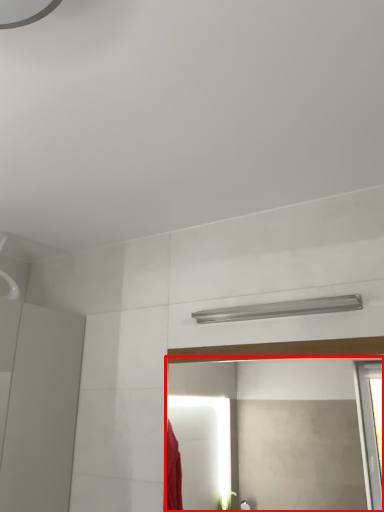
Question: From the image's perspective, where is mirror (annotated by the red box) located in relation to shower in the image?

Choices:
 (A) above
 (B) below

Answer: (B)